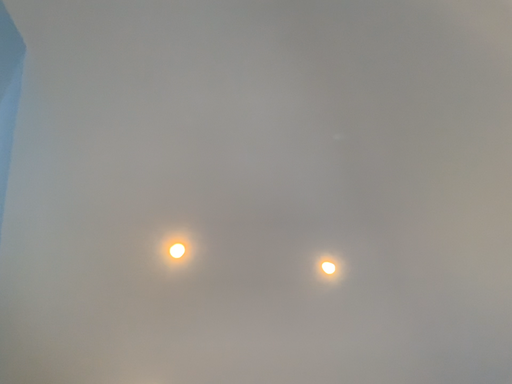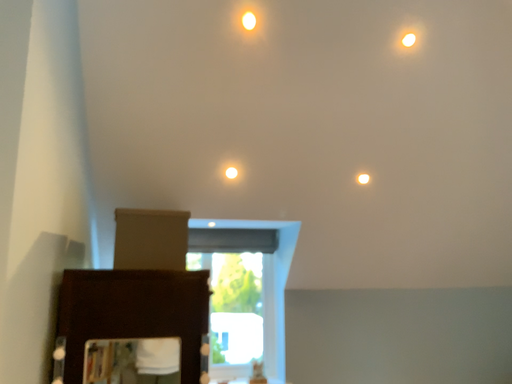
Question: Which way did the camera rotate in the video?

Choices:
 (A) rotated left
 (B) rotated right

Answer: (A)